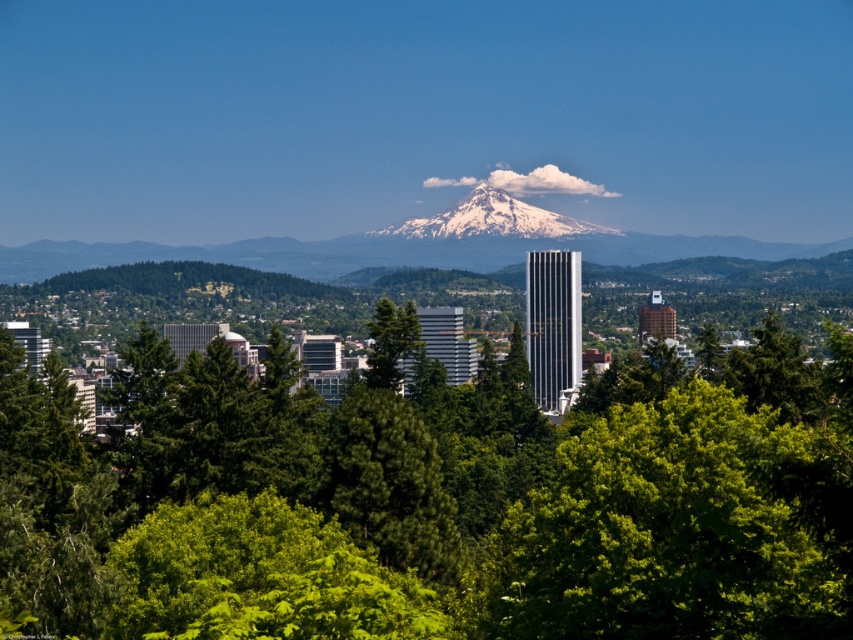
Question: Can you confirm if green leafy tree at center is bigger than snowy peak at center?

Choices:
 (A) yes
 (B) no

Answer: (A)

Question: Can you confirm if green leafy tree at center is bigger than snowy peak at center?

Choices:
 (A) yes
 (B) no

Answer: (A)

Question: Which of the following is the closest to the observer?

Choices:
 (A) (376, 232)
 (B) (598, 596)

Answer: (A)

Question: Is green leafy tree at center in front of snowy peak at center?

Choices:
 (A) no
 (B) yes

Answer: (B)